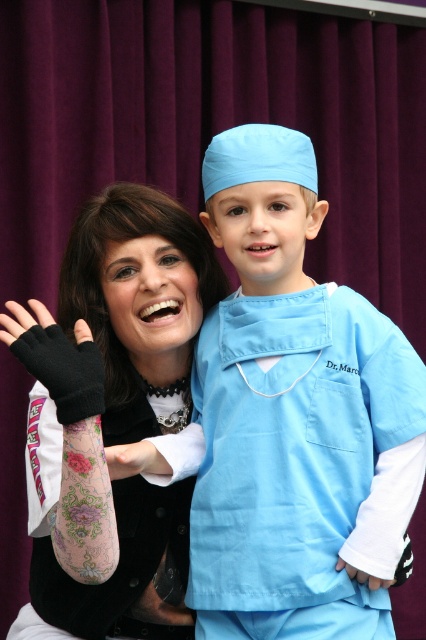
You are a photographer standing in front of the maroon curtain backdrop. You need to capture a clear photo of both the light blue fabric at center and the floral tattooed arm at center. Which object should you focus on first to ensure both are in focus?

You should focus on the light blue fabric at center first because it is closer to you than the floral tattooed arm at center. By focusing on the closer object, both will be in focus as the farther object will fall within the depth of field.

You are a photographer adjusting the focus on your camera. You notice a point at coordinates (x=287, y=410) in the image. Based on the scene description, what object or part of the scene does this point most likely correspond to?

The point at coordinates (x=287, y=410) corresponds to the light blue fabric at center, which is part of the child dressed in light blue medical scrubs labeled Dr. Marco on the chest pocket.

Consider the image. You are standing 1.44 meters away from the camera. You want to take a photo of the scene. If you move forward by 0.5 meters, how far will you be from the point marked at coordinates point [276,173]?

The point marked at coordinates point [276,173] is 1.44 meters away from the camera. If you move forward by 0.5 meters, your new distance from the camera would be 1.44 meters minus 0.5 meters, which equals 0.94 meters. Therefore, you would be 0.94 meters away from the point marked at coordinates point [276,173].